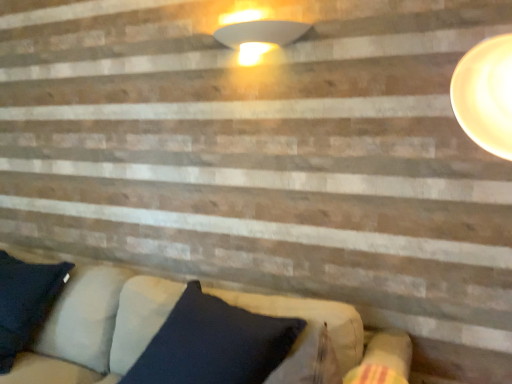
Question: From the image's perspective, is white glossy lampshade at upper center above or below velvet dark blue pillow at lower center?

Choices:
 (A) above
 (B) below

Answer: (A)

Question: Is white glossy lampshade at upper center in front of or behind velvet dark blue pillow at lower center in the image?

Choices:
 (A) behind
 (B) front

Answer: (A)

Question: Is white glossy lampshade at upper center taller or shorter than velvet dark blue pillow at lower center?

Choices:
 (A) short
 (B) tall

Answer: (A)

Question: Is velvet dark blue pillow at lower center taller or shorter than white glossy lampshade at upper center?

Choices:
 (A) tall
 (B) short

Answer: (A)

Question: Considering the positions of velvet dark blue pillow at lower center and white glossy lampshade at upper center in the image, is velvet dark blue pillow at lower center bigger or smaller than white glossy lampshade at upper center?

Choices:
 (A) big
 (B) small

Answer: (A)

Question: Does point (327, 314) appear closer or farther from the camera than point (261, 31)?

Choices:
 (A) closer
 (B) farther

Answer: (A)

Question: Choose the correct answer: Is velvet dark blue pillow at lower center inside white glossy lampshade at upper center or outside it?

Choices:
 (A) inside
 (B) outside

Answer: (B)